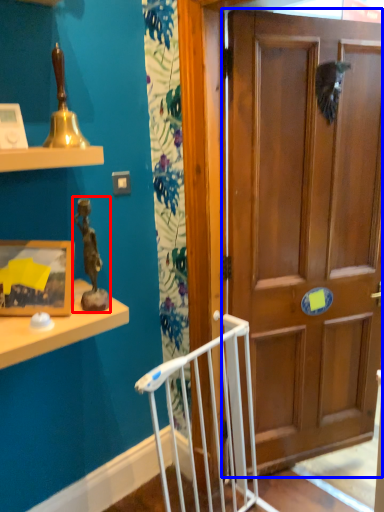
Question: Which of the following is the closest to the observer, toy (highlighted by a red box) or door (highlighted by a blue box)?

Choices:
 (A) toy
 (B) door

Answer: (A)